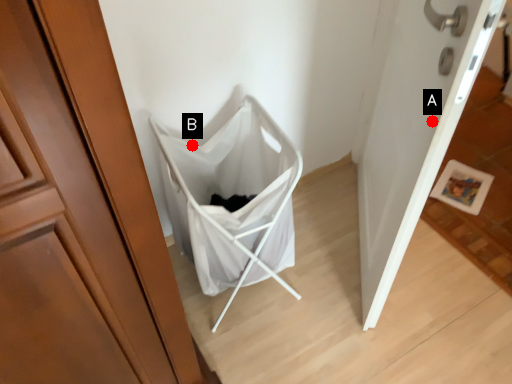
Question: Two points are circled on the image, labeled by A and B beside each circle. Which point appears farthest from the camera in this image?

Choices:
 (A) A is further
 (B) B is further

Answer: (B)